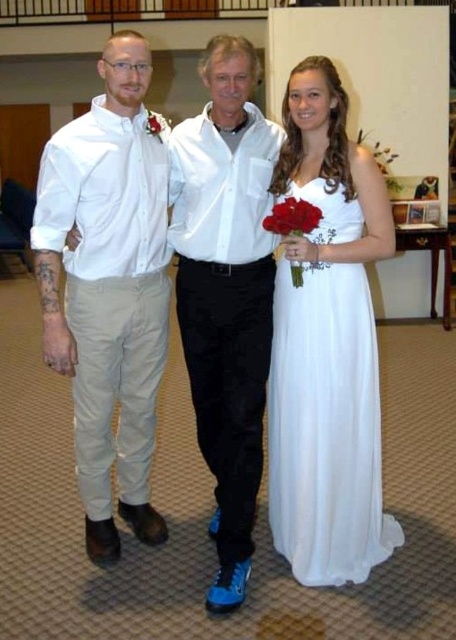
In the scene shown: Please look at the scene described. There is a point at coordinates (226, 291). What object is located at that point?

The point at coordinates (226, 291) indicates the white smooth shirt at center.